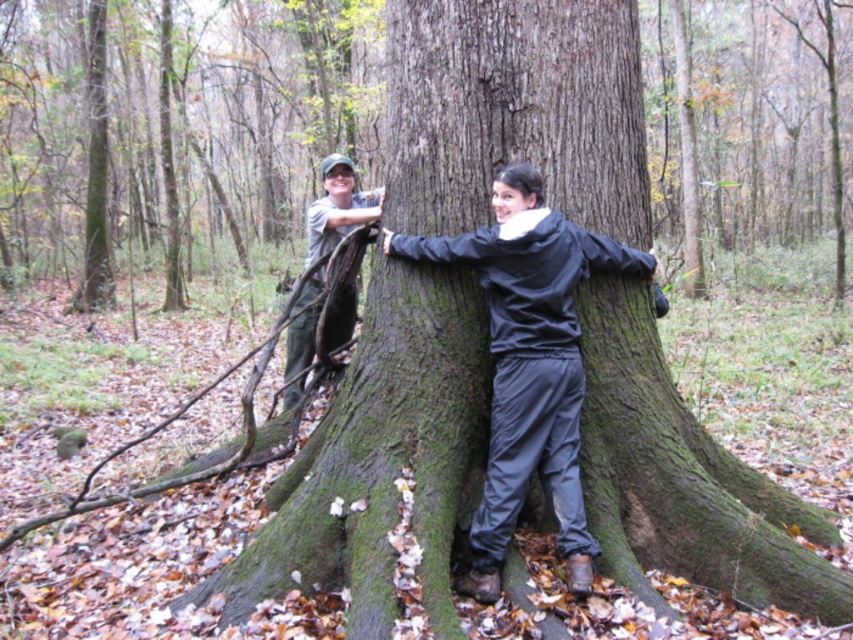
You are standing in a forest during autumn and see a large tree trunk with two people embracing it. There is a point at coordinates (527, 365). According to the scene, which object is this point located on?

The point at (527, 365) is located on the matte gray jacket at center.

You are standing in the forest and see two points marked on the ground. The first point is at coordinates point (564,428) and the second is at point (331,232). If you want to walk towards the tree that the two people are hugging, which point should you walk towards?

You should walk towards point (564,428) because it is in front of point (331,232), indicating it is closer to the tree that the two people are hugging.